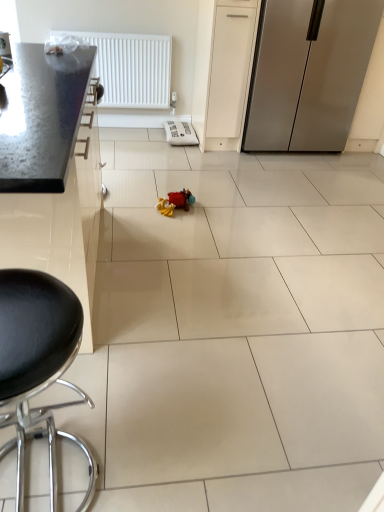
Question: In the image, is satin silver refrigerator at right on the left side or the right side of soft plush toy at center?

Choices:
 (A) left
 (B) right

Answer: (B)

Question: From the image's perspective, is satin silver refrigerator at right positioned above or below soft plush toy at center?

Choices:
 (A) below
 (B) above

Answer: (B)

Question: Based on their relative distances, which object is farther from the soft plush toy at center?

Choices:
 (A) satin silver refrigerator at right
 (B) black leather stool at lower left
 (C) metallic countertop at left
 (D) white plastic radiator at upper left

Answer: (D)

Question: Which of these objects is positioned closest to the metallic countertop at left?

Choices:
 (A) black leather stool at lower left
 (B) white plastic radiator at upper left
 (C) satin silver refrigerator at right
 (D) soft plush toy at center

Answer: (A)